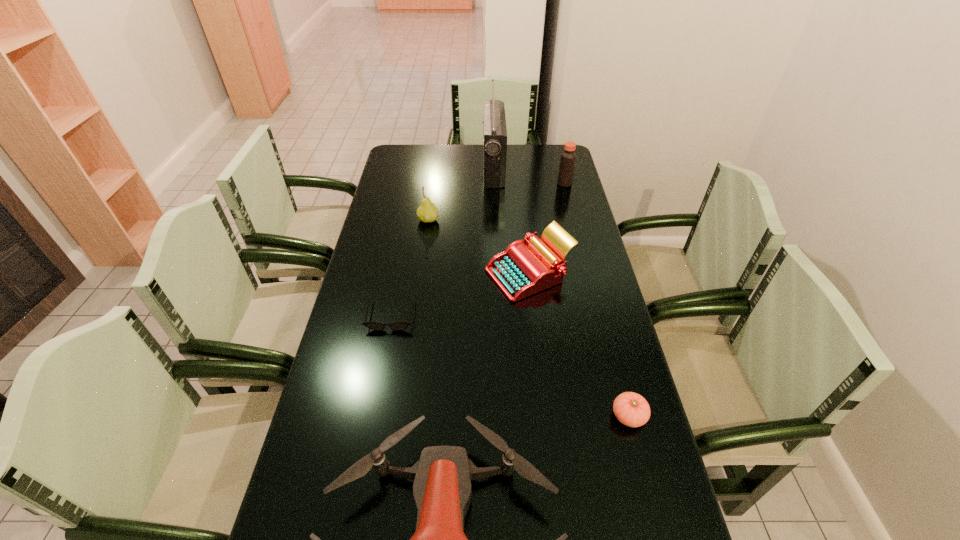
This screenshot has height=540, width=960. In order to click on radio receiver in this screenshot , I will do `click(495, 132)`.

At what (x,y) coordinates should I click in order to perform the action: click on vinegar. Please return your answer as a coordinate pair (x, y). The image size is (960, 540). Looking at the image, I should click on (568, 157).

Where is `pear`? Image resolution: width=960 pixels, height=540 pixels. pear is located at coordinates (427, 212).

The image size is (960, 540). Find the location of `typewriter`. typewriter is located at coordinates (522, 270).

In order to click on tomato in this screenshot , I will do `click(631, 409)`.

Identify the location of the sixth tallest object. This screenshot has height=540, width=960. (631, 409).

The width and height of the screenshot is (960, 540). I want to click on the shortest object, so click(x=397, y=326).

Identify the location of free spot located 0.080m on the front-facing side of the tallest object. (464, 168).

Find the location of a particular element. vacant region located on the front-facing side of the tallest object is located at coordinates (467, 168).

In order to click on vacant space situated 0.050m on the front-facing side of the tallest object in this screenshot , I will do `click(471, 168)`.